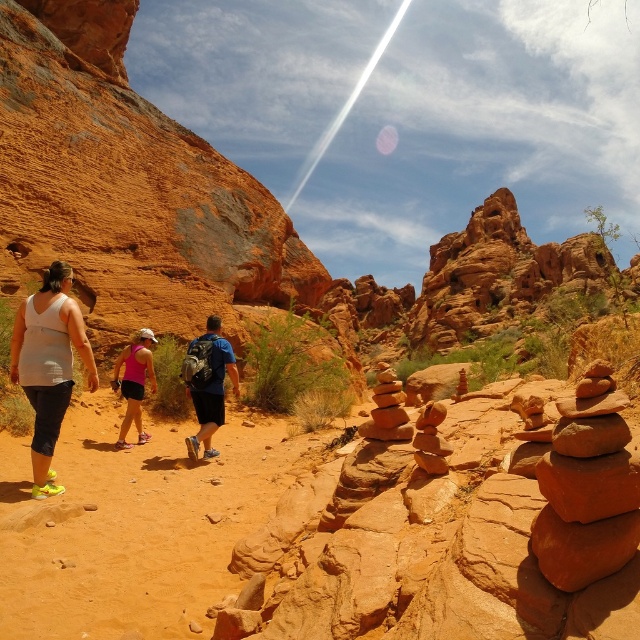
Who is higher up, sandy dirt trail at center or blue fabric backpack at center?

blue fabric backpack at center is above.

Is sandy dirt trail at center taller than blue fabric backpack at center?

No, sandy dirt trail at center is not taller than blue fabric backpack at center.

Identify the location of sandy dirt trail at center. (136, 524).

Where is `sandy dirt trail at center`? This screenshot has width=640, height=640. sandy dirt trail at center is located at coordinates (136, 524).

Does white matte tank top at left have a greater width compared to pink fabric shorts at lower left?

Indeed, white matte tank top at left has a greater width compared to pink fabric shorts at lower left.

Is white matte tank top at left smaller than pink fabric shorts at lower left?

No, white matte tank top at left is not smaller than pink fabric shorts at lower left.

Where is `white matte tank top at left`? white matte tank top at left is located at coordinates (49, 364).

Can you confirm if sandy dirt trail at center is positioned to the right of pink fabric shorts at lower left?

Indeed, sandy dirt trail at center is positioned on the right side of pink fabric shorts at lower left.

Can you confirm if sandy dirt trail at center is positioned below pink fabric shorts at lower left?

Correct, sandy dirt trail at center is located below pink fabric shorts at lower left.

Does point (225, 445) come behind point (145, 374)?

Yes.

This screenshot has width=640, height=640. In order to click on sandy dirt trail at center in this screenshot , I will do `click(136, 524)`.